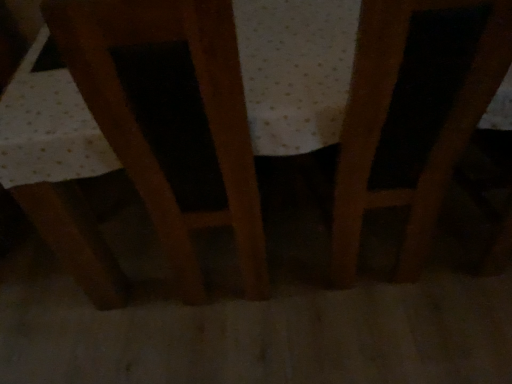
Where is `free space to the right of wooden swivel chair at center`? The width and height of the screenshot is (512, 384). free space to the right of wooden swivel chair at center is located at coordinates (330, 266).